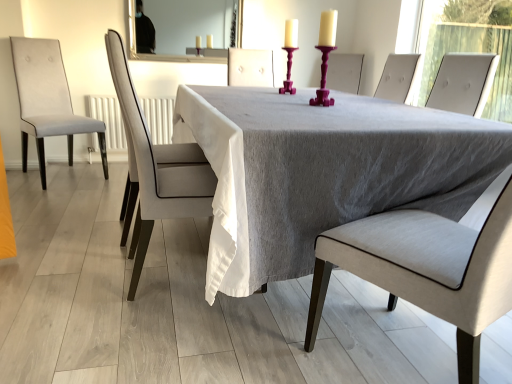
Question: Is point (348, 228) positioned closer to the camera than point (187, 203)?

Choices:
 (A) closer
 (B) farther

Answer: (A)

Question: In terms of size, does light gray fabric chair at center, the 3th chair from the left, appear bigger or smaller than light gray fabric chair at center, which ranks as the second chair in front-to-back order?

Choices:
 (A) big
 (B) small

Answer: (A)

Question: Considering the real-world distances, which object is closest to the gray fabric table at center?

Choices:
 (A) light gray fabric chair at center, the third chair in the back-to-front sequence
 (B) purple glossy candle holder at center, the 1th candle holder positioned from the back
 (C) purple plastic candle holder at center, which is the second candle holder in back-to-front order
 (D) light gray fabric chair at center, acting as the 2th chair starting from the left
 (E) white glossy mirror at upper center

Answer: (A)

Question: Based on their relative distances, which object is farther from the light gray fabric chair at center, which ranks as the first chair in front-to-back order?

Choices:
 (A) gray fabric table at center
 (B) purple plastic candle holder at center, the first candle holder in the front-to-back sequence
 (C) purple glossy candle holder at center, marked as the 2th candle holder in a front-to-back arrangement
 (D) light gray fabric chair at center, which ranks as the 2th chair in back-to-front order
 (E) light gray fabric chair at left, positioned as the first chair in left-to-right order

Answer: (E)